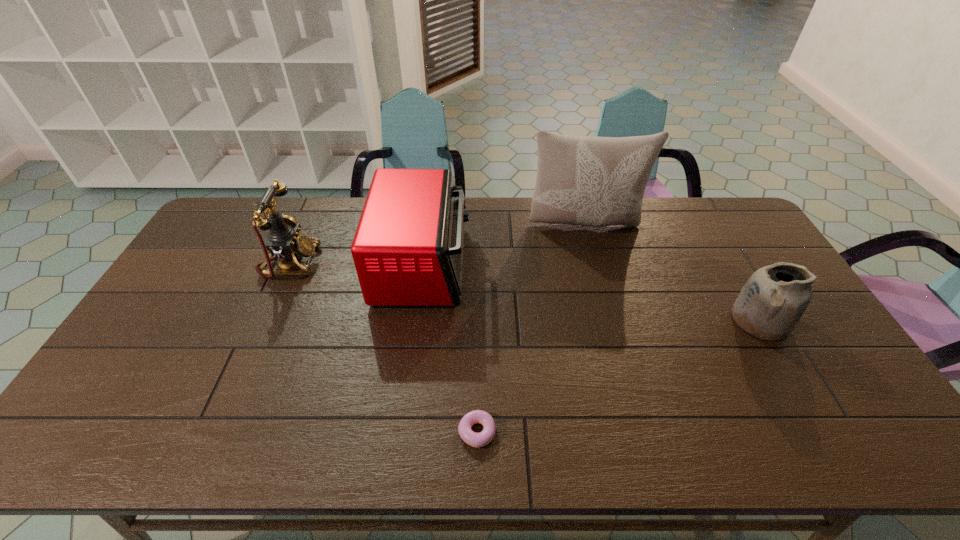
Select which object appears as the closest to the rightmost object. Please provide its 2D coordinates. Your answer should be formatted as a tuple, i.e. [(x, y)], where the tuple contains the x and y coordinates of a point satisfying the conditions above.

[(581, 180)]

Choose which object is the fourth nearest neighbor to the second object from right to left. Please provide its 2D coordinates. Your answer should be formatted as a tuple, i.e. [(x, y)], where the tuple contains the x and y coordinates of a point satisfying the conditions above.

[(283, 241)]

You are a GUI agent. You are given a task and a screenshot of the screen. Output one action in this format:
    pyautogui.click(x=<x>, y=<y>)
    Task: Click on the vacant region that satisfies the following two spatial constraints: 1. on the front-facing side of the toaster oven; 2. on the left side of the nearest object
    
    Given the screenshot: What is the action you would take?
    pyautogui.click(x=400, y=432)

Locate an element on the screen. Image resolution: width=960 pixels, height=540 pixels. free space that satisfies the following two spatial constraints: 1. on the front-facing side of the toaster oven; 2. on the left side of the shortest object is located at coordinates (400, 432).

What are the coordinates of `vacant space that satisfies the following two spatial constraints: 1. on the front of the second shortest object, featuring the rotary dial; 2. on the right side of the leftmost object` in the screenshot? It's located at (266, 319).

Locate an element on the screen. This screenshot has height=540, width=960. free location that satisfies the following two spatial constraints: 1. on the front of the leftmost object, featuring the rotary dial; 2. on the left side of the pottery is located at coordinates (266, 319).

Locate an element on the screen. The height and width of the screenshot is (540, 960). free point that satisfies the following two spatial constraints: 1. on the front of the telephone, featuring the rotary dial; 2. on the left side of the nearest object is located at coordinates (216, 432).

This screenshot has height=540, width=960. I want to click on vacant region that satisfies the following two spatial constraints: 1. on the back side of the rightmost object; 2. on the front-facing side of the toaster oven, so click(729, 266).

Find the location of a particular element. The image size is (960, 540). vacant position in the image that satisfies the following two spatial constraints: 1. on the front side of the cushion; 2. on the front of the leftmost object, featuring the rotary dial is located at coordinates (595, 263).

Where is `vacant space that satisfies the following two spatial constraints: 1. on the back side of the doughnut; 2. on the front-facing side of the toaster oven`? The width and height of the screenshot is (960, 540). vacant space that satisfies the following two spatial constraints: 1. on the back side of the doughnut; 2. on the front-facing side of the toaster oven is located at coordinates (478, 266).